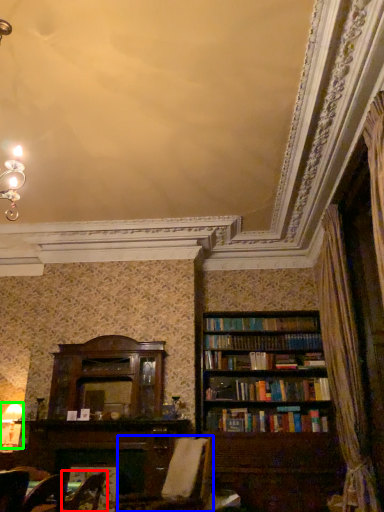
Question: Considering the real-world distances, which object is closest to armchair (highlighted by a red box)? swivel chair (highlighted by a blue box) or lamp (highlighted by a green box).

Choices:
 (A) swivel chair
 (B) lamp

Answer: (A)